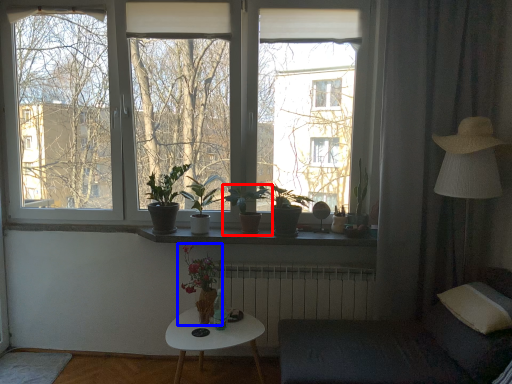
Question: Which point is closer to the camera, houseplant (highlighted by a red box) or houseplant (highlighted by a blue box)?

Choices:
 (A) houseplant
 (B) houseplant

Answer: (B)